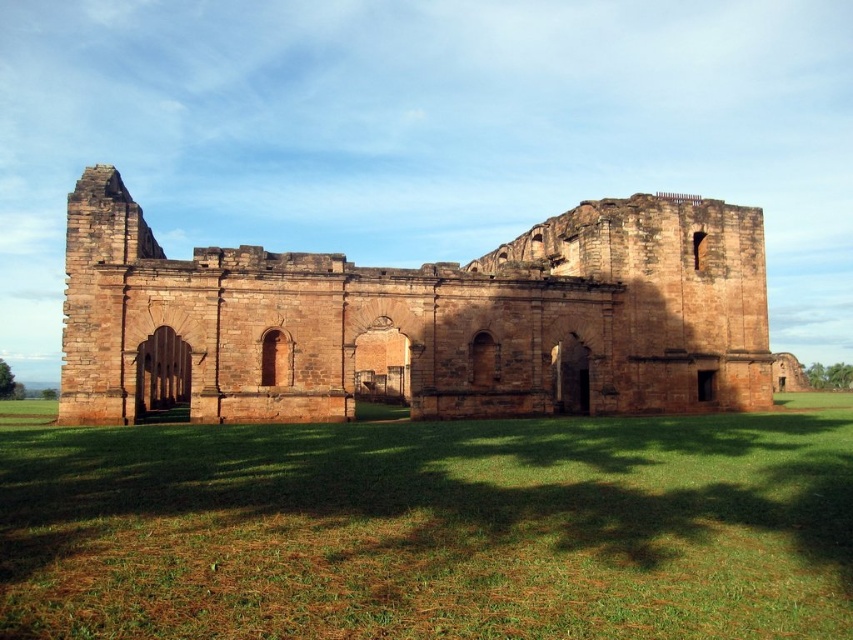
Does point (779, 422) come in front of point (579, 365)?

Yes.

Does green grass at center have a lesser height compared to brown stone ruins at center?

Yes, green grass at center is shorter than brown stone ruins at center.

You are a GUI agent. You are given a task and a screenshot of the screen. Output one action in this format:
    pyautogui.click(x=<x>, y=<y>)
    Task: Click on the green grass at center
    Image resolution: width=853 pixels, height=640 pixels.
    Given the screenshot: What is the action you would take?
    pyautogui.click(x=432, y=529)